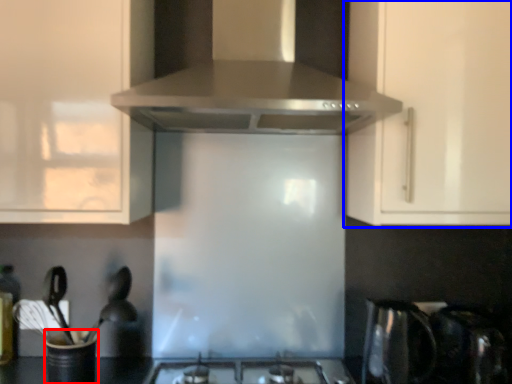
Question: Which object is closer to the camera taking this photo, appliance (highlighted by a red box) or cabinetry (highlighted by a blue box)?

Choices:
 (A) appliance
 (B) cabinetry

Answer: (A)